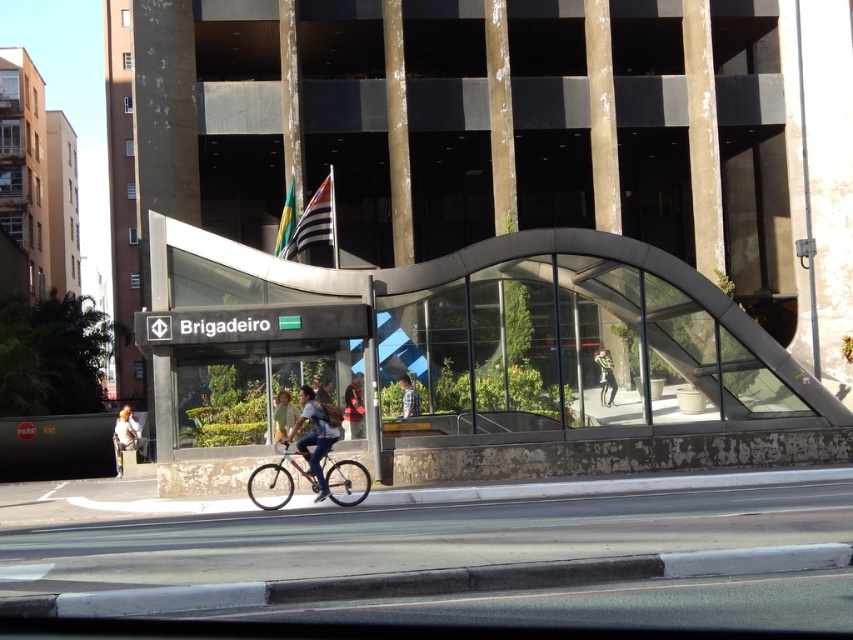
You are a pedestrian standing on the sidewalk near the Brigadeiro building. You see a cyclist wearing an orange fabric shirt at lower left and a person wearing a red fabric jacket at center. Which person is closer to you?

The orange fabric shirt at lower left is closer to you because the red fabric jacket at center is behind it.